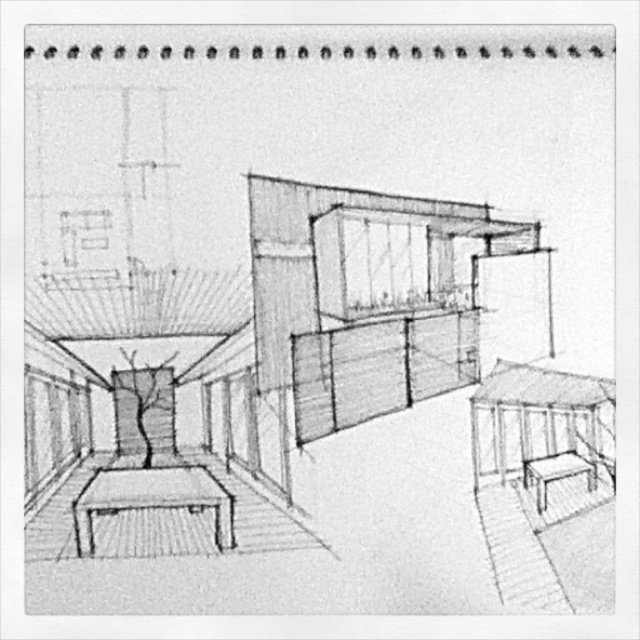
Between smooth wooden table at lower left and matte wood stool at lower right, which one is positioned higher?

matte wood stool at lower right is higher up.

Between smooth wooden table at lower left and matte wood stool at lower right, which one is positioned lower?

Positioned lower is smooth wooden table at lower left.

Does point (173, 504) lie behind point (586, 481)?

Yes, point (173, 504) is behind point (586, 481).

Image resolution: width=640 pixels, height=640 pixels. I want to click on smooth wooden table at lower left, so [152, 499].